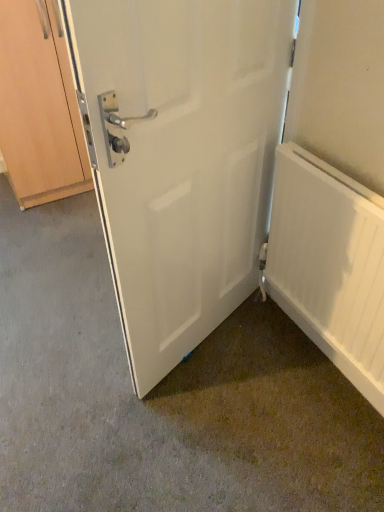
Identify the location of white matte door at center. (182, 158).

Based on the photo, measure the distance between wooden cabinet at left and camera.

A distance of 5.93 feet exists between wooden cabinet at left and camera.

Where is `white matte door at center`? This screenshot has height=512, width=384. white matte door at center is located at coordinates (182, 158).

In the image, there is a wooden cabinet at left. Identify the location of radiator below it (from the image's perspective). pos(330,264).

Considering the sizes of white matte radiator at right and wooden cabinet at left in the image, is white matte radiator at right wider or thinner than wooden cabinet at left?

Considering their sizes, white matte radiator at right looks slimmer than wooden cabinet at left.

Is wooden cabinet at left at the back of white matte radiator at right?

That's not correct — white matte radiator at right is not looking away from wooden cabinet at left.

Based on their positions, is wooden cabinet at left located to the left or right of white matte door at center?

In the image, wooden cabinet at left appears on the left side of white matte door at center.

Measure the distance from wooden cabinet at left to white matte door at center.

A distance of 4.23 feet exists between wooden cabinet at left and white matte door at center.

This screenshot has height=512, width=384. What are the coordinates of `cabinetry behind the white matte door at center` in the screenshot? It's located at (39, 106).

Does point (19, 155) come behind point (233, 274)?

That is True.

Based on the photo, is white matte door at center placed right next to wooden cabinet at left?

white matte door at center and wooden cabinet at left are clearly separated.

Can you confirm if white matte door at center is thinner than wooden cabinet at left?

Yes.

In the scene shown: Would you say white matte door at center is inside or outside wooden cabinet at left?

white matte door at center is outside wooden cabinet at left.

Is white matte radiator at right far from white matte door at center?

Actually, white matte radiator at right and white matte door at center are a little close together.

Choose the correct answer: Is white matte radiator at right inside white matte door at center or outside it?

white matte radiator at right is spatially situated outside white matte door at center.

In the scene shown: Measure the distance from white matte radiator at right to white matte door at center.

A distance of 14.53 inches exists between white matte radiator at right and white matte door at center.

Can you confirm if white matte door at center is positioned to the right of white matte radiator at right?

In fact, white matte door at center is to the left of white matte radiator at right.

Looking at this image, is white matte door at center not close to white matte radiator at right?

→ white matte door at center is actually quite close to white matte radiator at right.

This screenshot has width=384, height=512. Find the location of `radiator below the white matte door at center (from the image's perspective)`. radiator below the white matte door at center (from the image's perspective) is located at coordinates (330, 264).

From a real-world perspective, is white matte door at center under white matte radiator at right?

No.

Which object is further away from the camera, wooden cabinet at left or white matte radiator at right?

Positioned behind is wooden cabinet at left.

From the image's perspective, relative to white matte radiator at right, is wooden cabinet at left above or below?

From the image's perspective, wooden cabinet at left appears above white matte radiator at right.

Based on the photo, could you tell me if wooden cabinet at left is facing white matte radiator at right?

Yes, wooden cabinet at left faces towards white matte radiator at right.

Is point (74, 183) positioned after point (352, 298)?

Yes, it is behind point (352, 298).

In the image, there is a wooden cabinet at left. Identify the location of radiator below it (from a real-world perspective). This screenshot has width=384, height=512. (330, 264).

At what (x,y) coordinates should I click in order to perform the action: click on door in front of the wooden cabinet at left. Please return your answer as a coordinate pair (x, y). Looking at the image, I should click on (182, 158).

Estimate the real-world distances between objects in this image. Which object is closer to wooden cabinet at left, white matte radiator at right or white matte door at center?

white matte door at center.

Which object lies further to the anchor point white matte door at center, white matte radiator at right or wooden cabinet at left?

wooden cabinet at left lies further to white matte door at center than the other object.

Estimate the real-world distances between objects in this image. Which object is closer to wooden cabinet at left, white matte door at center or white matte radiator at right?

The object closer to wooden cabinet at left is white matte door at center.

From the image, which object appears to be farther from white matte radiator at right, wooden cabinet at left or white matte door at center?

The object further to white matte radiator at right is wooden cabinet at left.

When comparing their distances from white matte radiator at right, does white matte door at center or wooden cabinet at left seem further?

wooden cabinet at left is positioned further to the anchor white matte radiator at right.

Based on their spatial positions, is wooden cabinet at left or white matte radiator at right further from white matte door at center?

Based on the image, wooden cabinet at left appears to be further to white matte door at center.

At what (x,y) coordinates should I click in order to perform the action: click on door between wooden cabinet at left and white matte radiator at right from left to right. Please return your answer as a coordinate pair (x, y). The image size is (384, 512). Looking at the image, I should click on (182, 158).